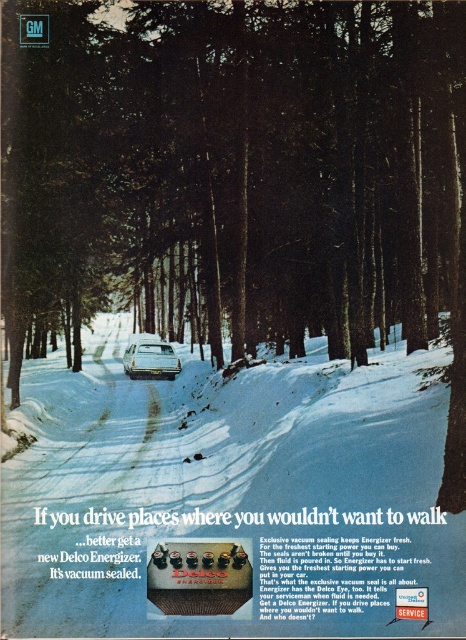
Can you confirm if white powdery snow at center is positioned to the right of shiny silver car at center?

Indeed, white powdery snow at center is positioned on the right side of shiny silver car at center.

Who is more distant from viewer, (x=461, y=605) or (x=142, y=369)?

Positioned behind is point (x=142, y=369).

Is point (253, 445) positioned behind point (143, 353)?

No, (253, 445) is in front of (143, 353).

The height and width of the screenshot is (640, 466). I want to click on white powdery snow at center, so (x=228, y=499).